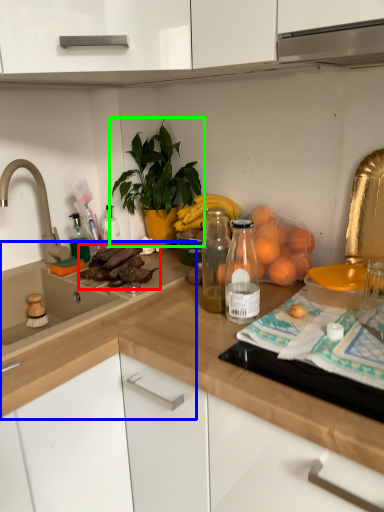
Question: Considering the real-world distances, which object is closest to food (highlighted by a red box)? countertop (highlighted by a blue box) or houseplant (highlighted by a green box).

Choices:
 (A) countertop
 (B) houseplant

Answer: (A)